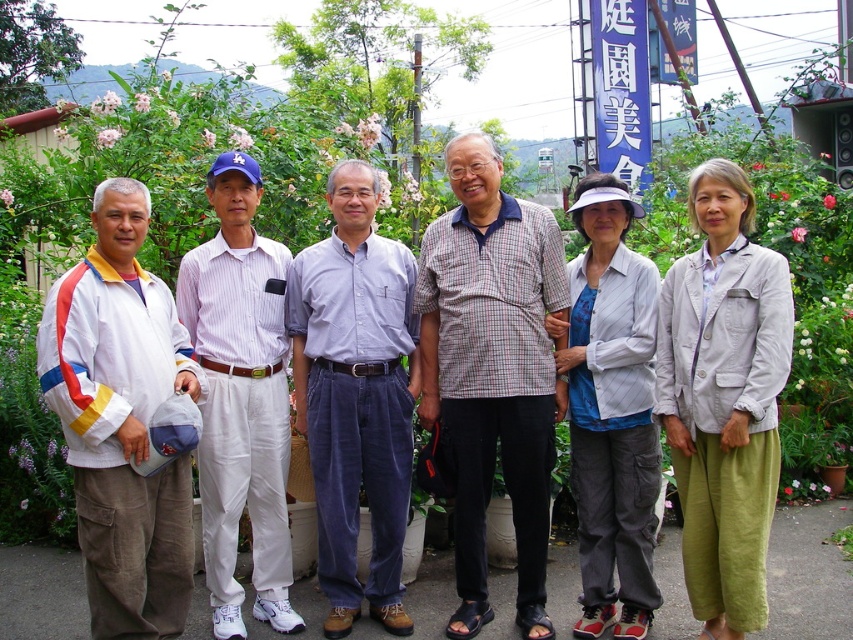
Is white cotton jacket at left above white striped shirt at center?

No, white cotton jacket at left is not above white striped shirt at center.

The height and width of the screenshot is (640, 853). Describe the element at coordinates (120, 420) in the screenshot. I see `white cotton jacket at left` at that location.

Locate an element on the screen. This screenshot has width=853, height=640. white cotton jacket at left is located at coordinates (120, 420).

Describe the element at coordinates (120, 420) in the screenshot. Image resolution: width=853 pixels, height=640 pixels. I see `white cotton jacket at left` at that location.

Who is more forward, (x=71, y=292) or (x=635, y=257)?

Point (x=71, y=292) is more forward.

Between point (196, 378) and point (582, 358), which one is positioned in front?

Positioned in front is point (196, 378).

I want to click on white cotton jacket at left, so click(x=120, y=420).

Between plaid cotton shirt at center and white cotton jacket at left, which one has less height?

white cotton jacket at left is shorter.

Does point (486, 241) come behind point (117, 202)?

Yes, point (486, 241) is behind point (117, 202).

This screenshot has width=853, height=640. What are the coordinates of `plaid cotton shirt at center` in the screenshot? It's located at (492, 369).